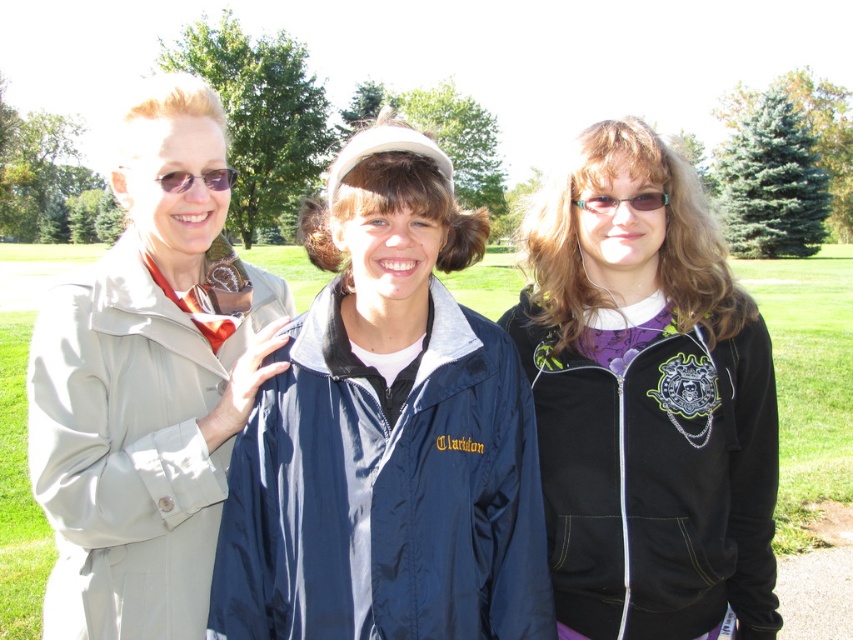
Question: Can you confirm if navy blue jacket at center is positioned above matte black sunglasses at upper left?

Choices:
 (A) yes
 (B) no

Answer: (B)

Question: Can you confirm if navy blue jacket at center is positioned to the left of matte beige trench coat at left?

Choices:
 (A) no
 (B) yes

Answer: (A)

Question: Based on their relative distances, which object is nearer to the matte plastic glasses at center?

Choices:
 (A) navy blue jacket at center
 (B) matte black sunglasses at upper left
 (C) black matte jacket at center

Answer: (C)

Question: Which of the following is the farthest from the observer?

Choices:
 (A) matte plastic glasses at center
 (B) matte beige trench coat at left
 (C) navy blue jacket at center
 (D) black matte jacket at center

Answer: (A)

Question: Is matte beige trench coat at left closer to the viewer compared to matte black sunglasses at upper left?

Choices:
 (A) yes
 (B) no

Answer: (A)

Question: Among these points, which one is nearest to the camera?

Choices:
 (A) coord(374,403)
 (B) coord(647,208)

Answer: (A)